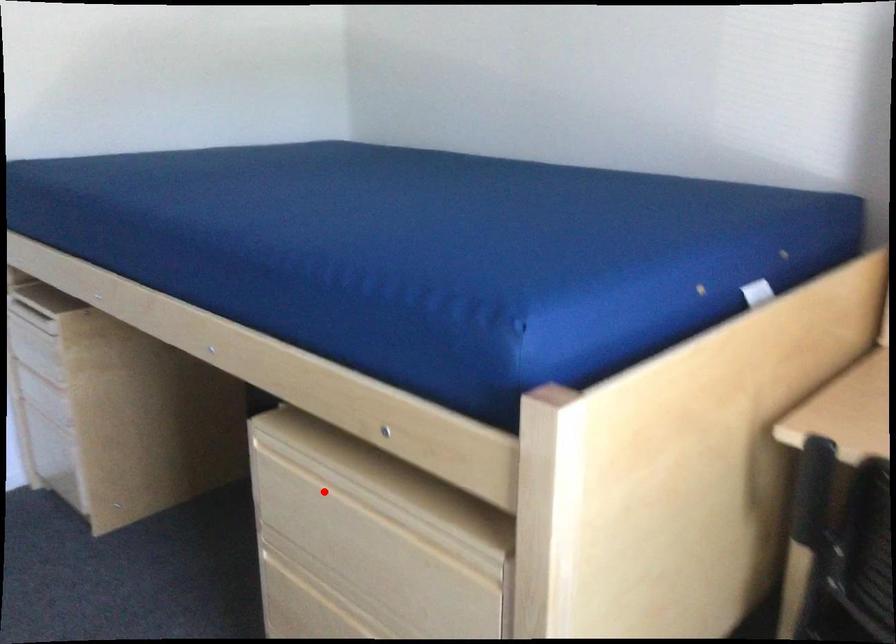
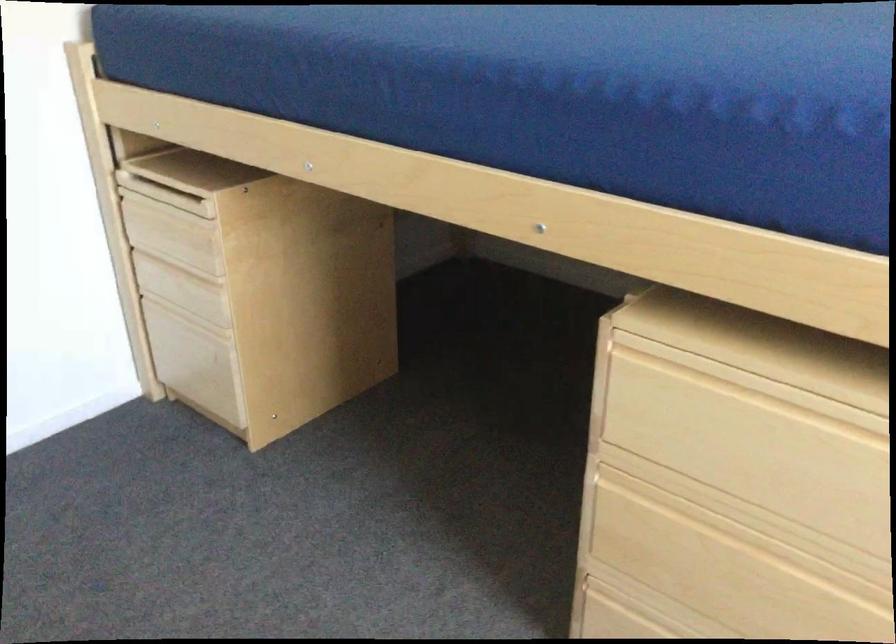
Question: I am providing you with two images of the same scene from different viewpoints. In image1, a red point is highlighted. Considering the same 3D point in image2, which of the following is correct?

Choices:
 (A) It is closer
 (B) It is farther

Answer: (A)